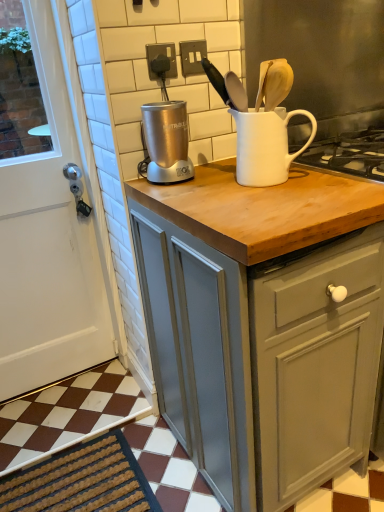
At what (x,y) coordinates should I click in order to perform the action: click on empty space that is to the right of white ceramic jug at upper center. Please return your answer as a coordinate pair (x, y). The height and width of the screenshot is (512, 384). Looking at the image, I should click on (325, 175).